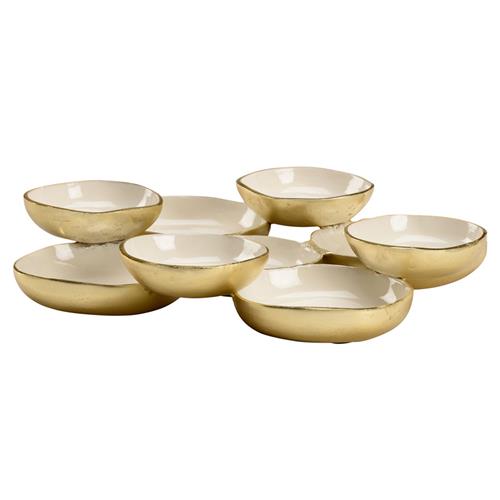
Locate an element on the screen. This screenshot has width=500, height=500. middle bowls is located at coordinates (279, 252), (214, 248), (215, 215), (287, 194).